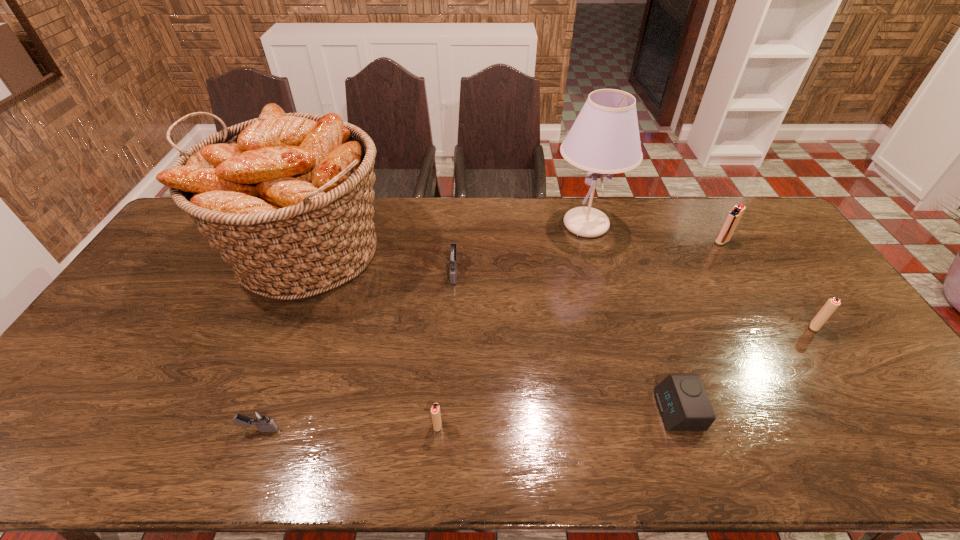
In order to click on the nearer gray igniter in this screenshot , I will do `click(259, 417)`.

You are a GUI agent. You are given a task and a screenshot of the screen. Output one action in this format:
    pyautogui.click(x=<x>, y=<y>)
    Task: Click on the leftmost igniter
    The height and width of the screenshot is (540, 960).
    Given the screenshot: What is the action you would take?
    pyautogui.click(x=259, y=417)

The image size is (960, 540). Identify the location of alarm clock. (682, 400).

Image resolution: width=960 pixels, height=540 pixels. Find the location of `black alarm clock`. black alarm clock is located at coordinates point(682,400).

The image size is (960, 540). I want to click on vacant space located on the left of the lampshade, so click(x=453, y=225).

Image resolution: width=960 pixels, height=540 pixels. I want to click on free point located on the front of the basket, so click(252, 376).

Image resolution: width=960 pixels, height=540 pixels. I want to click on free space located 0.070m on the back of the farthest red igniter, so coord(711,225).

Identify the location of free location located 0.250m on the back of the right gray igniter. (458, 214).

This screenshot has height=540, width=960. In order to click on blank area located 0.070m on the left of the rightmost red igniter in this screenshot , I will do `click(783, 327)`.

Find the location of `vacant area situated on the back of the smallest red igniter`. vacant area situated on the back of the smallest red igniter is located at coordinates (444, 344).